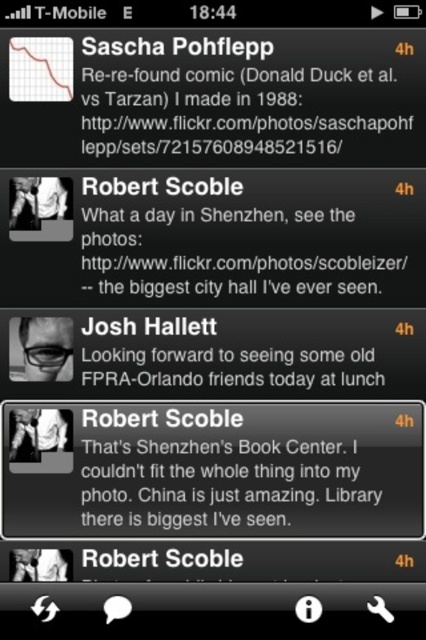
You are using a dark mode mobile app and want to read a message clearly. Which object, the black matte text message at center or the black matte glasses at center, is easier to see?

The black matte text message at center is easier to see because it has a larger size compared to the black matte glasses at center.

You are trying to locate the black matte glasses at center in the image. According to the coordinate system where the bottom left corner is the origin, can you confirm their position?

The black matte glasses at center are located at point coordinates of [46,348].